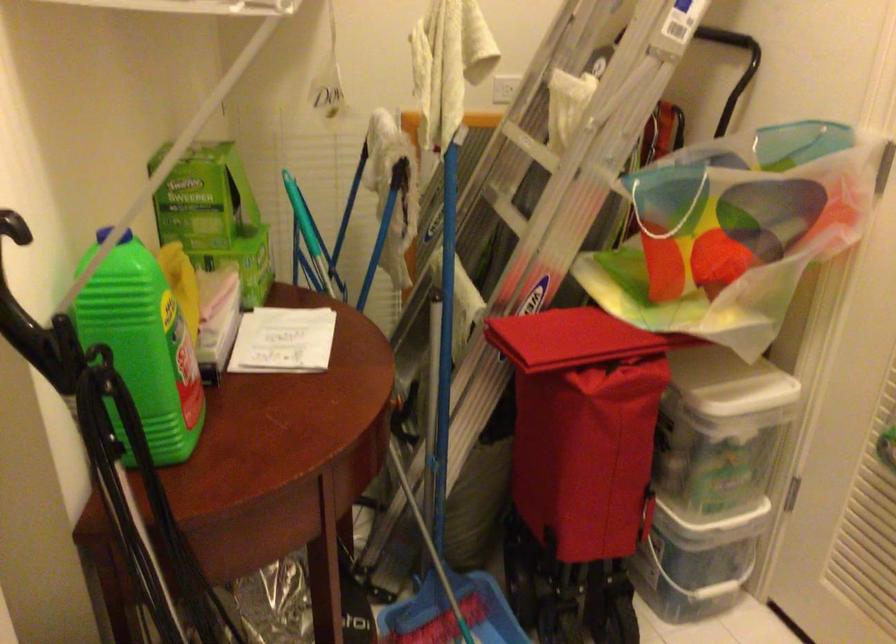
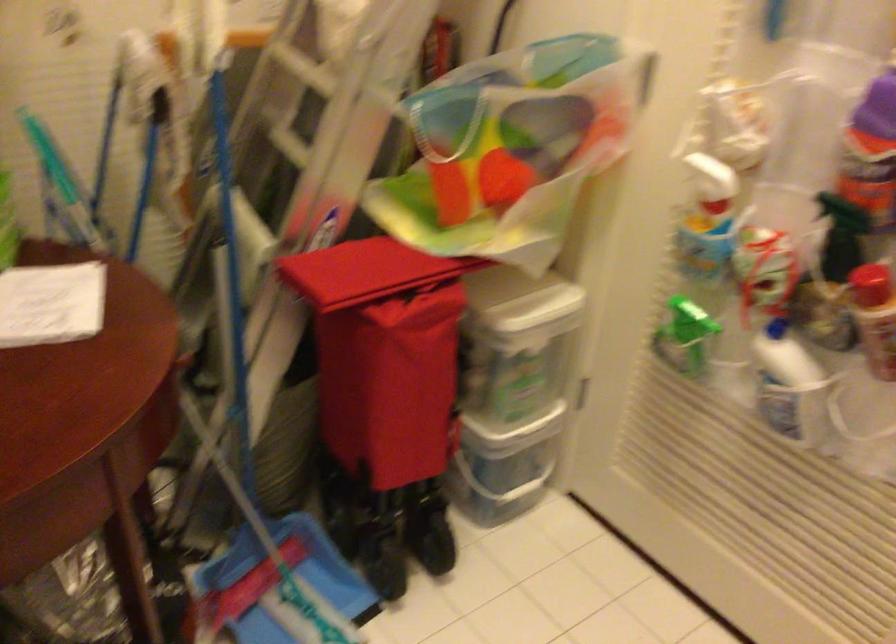
Question: In a continuous first-person perspective shot, in which direction is the camera moving?

Choices:
 (A) Left
 (B) Right
 (C) Forward
 (D) Backward

Answer: (C)